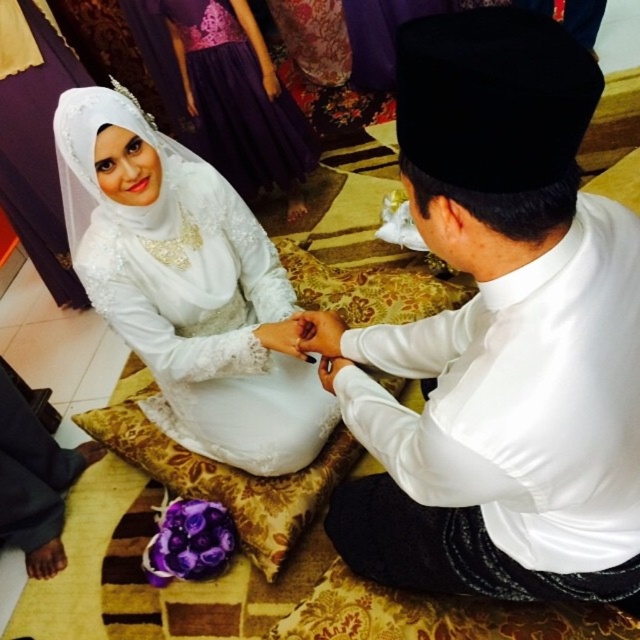
Who is shorter, white lace dress at upper left or white lace veil at upper left?

With less height is white lace veil at upper left.

Can you confirm if white lace dress at upper left is smaller than white lace veil at upper left?

Yes.

Does point (228, 406) come in front of point (256, 45)?

Yes, point (228, 406) is closer to viewer.

This screenshot has width=640, height=640. I want to click on white lace dress at upper left, so click(x=188, y=288).

Is white satin shirt at center shorter than white lace dress at upper left?

Correct, white satin shirt at center is not as tall as white lace dress at upper left.

Is white satin shirt at center below white lace dress at upper left?

Indeed, white satin shirt at center is positioned under white lace dress at upper left.

What do you see at coordinates (500, 336) in the screenshot? The height and width of the screenshot is (640, 640). I see `white satin shirt at center` at bounding box center [500, 336].

The image size is (640, 640). Identify the location of white satin shirt at center. (500, 336).

Can you confirm if white lace dress at upper left is shorter than white satin hand at center?

Incorrect, white lace dress at upper left's height does not fall short of white satin hand at center's.

Does white lace dress at upper left have a greater height compared to white satin hand at center?

Yes, white lace dress at upper left is taller than white satin hand at center.

Who is more forward, (273, 346) or (321, 346)?

Point (321, 346) is more forward.

The height and width of the screenshot is (640, 640). I want to click on white lace dress at upper left, so click(188, 288).